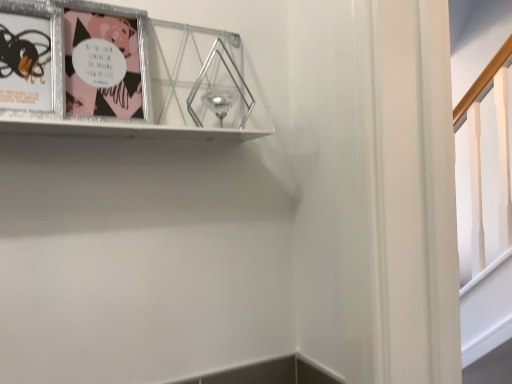
Question: From the image's perspective, is metallic silver picture frame at upper left, the 1th picture frame viewed from the left, above metallic silver picture frame at upper left, the third picture frame from the left?

Choices:
 (A) no
 (B) yes

Answer: (A)

Question: Is metallic silver picture frame at upper left, placed as the 3th picture frame when sorted from right to left, to the left of metallic silver picture frame at upper left, acting as the first picture frame starting from the right, from the viewer's perspective?

Choices:
 (A) no
 (B) yes

Answer: (B)

Question: From a real-world perspective, is metallic silver picture frame at upper left, the 1th picture frame viewed from the left, located beneath metallic silver picture frame at upper left, acting as the first picture frame starting from the right?

Choices:
 (A) no
 (B) yes

Answer: (B)

Question: Is metallic silver picture frame at upper left, acting as the first picture frame starting from the right, at the back of metallic silver picture frame at upper left, the 1th picture frame viewed from the left?

Choices:
 (A) no
 (B) yes

Answer: (B)

Question: Is metallic silver picture frame at upper left, placed as the 3th picture frame when sorted from right to left, positioned before metallic silver picture frame at upper left, acting as the first picture frame starting from the right?

Choices:
 (A) no
 (B) yes

Answer: (A)

Question: Is metallic silver picture frame at upper left, placed as the 3th picture frame when sorted from right to left, spatially inside metallic silver picture frame at upper left, acting as the first picture frame starting from the right, or outside of it?

Choices:
 (A) outside
 (B) inside

Answer: (B)

Question: From the image's perspective, relative to metallic silver picture frame at upper left, the third picture frame from the left, is metallic silver picture frame at upper left, the 1th picture frame viewed from the left, above or below?

Choices:
 (A) above
 (B) below

Answer: (B)

Question: From a real-world perspective, relative to metallic silver picture frame at upper left, the third picture frame from the left, is metallic silver picture frame at upper left, the 1th picture frame viewed from the left, vertically above or below?

Choices:
 (A) above
 (B) below

Answer: (B)

Question: In terms of height, does metallic silver picture frame at upper left, placed as the 3th picture frame when sorted from right to left, look taller or shorter compared to metallic silver picture frame at upper left, acting as the first picture frame starting from the right?

Choices:
 (A) tall
 (B) short

Answer: (B)

Question: Based on their sizes in the image, would you say metallic silver picture frame at upper left, acting as the first picture frame starting from the right, is bigger or smaller than metallic silver picture frame at upper left, the 1th picture frame viewed from the left?

Choices:
 (A) big
 (B) small

Answer: (A)

Question: From a real-world perspective, is metallic silver picture frame at upper left, the third picture frame from the left, physically located above or below metallic silver picture frame at upper left, the 1th picture frame viewed from the left?

Choices:
 (A) above
 (B) below

Answer: (A)

Question: Considering the positions of metallic silver picture frame at upper left, the third picture frame from the left, and metallic silver picture frame at upper left, the 1th picture frame viewed from the left, in the image, is metallic silver picture frame at upper left, the third picture frame from the left, wider or thinner than metallic silver picture frame at upper left, the 1th picture frame viewed from the left,?

Choices:
 (A) wide
 (B) thin

Answer: (A)

Question: Would you say metallic silver picture frame at upper left, acting as the first picture frame starting from the right, is to the left or to the right of metallic silver picture frame at upper left, placed as the 3th picture frame when sorted from right to left, in the picture?

Choices:
 (A) left
 (B) right

Answer: (B)

Question: Considering the positions of point (0, 97) and point (139, 64), is point (0, 97) closer or farther from the camera than point (139, 64)?

Choices:
 (A) closer
 (B) farther

Answer: (A)

Question: Do you think metallic silver picture frame at upper left, placed as the 3th picture frame when sorted from right to left, is within metallic silver picture frame at upper left, the 2th picture frame positioned from the right, or outside of it?

Choices:
 (A) inside
 (B) outside

Answer: (B)